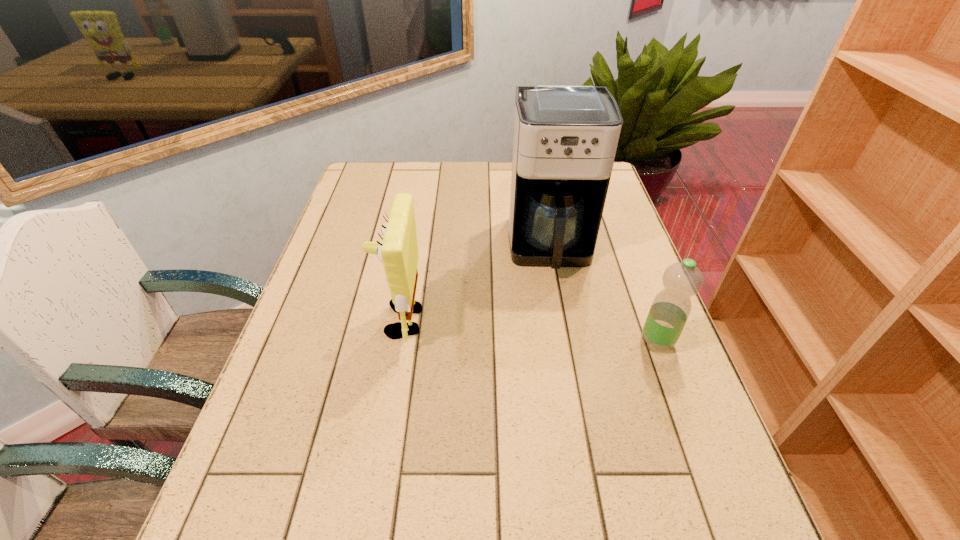
I want to click on free region located 0.060m on the front panel of the tallest object, so click(x=558, y=298).

At what (x,y) coordinates should I click in order to perform the action: click on vacant area situated 0.400m on the front panel of the tallest object. Please return your answer as a coordinate pair (x, y). Image resolution: width=960 pixels, height=540 pixels. Looking at the image, I should click on (576, 420).

You are a GUI agent. You are given a task and a screenshot of the screen. Output one action in this format:
    pyautogui.click(x=<x>, y=<y>)
    Task: Click on the free space located 0.370m on the front panel of the tallest object
    This screenshot has width=960, height=540.
    Given the screenshot: What is the action you would take?
    pyautogui.click(x=573, y=406)

At what (x,y) coordinates should I click in order to perform the action: click on water bottle present at the right edge. Please return your answer as a coordinate pair (x, y). Looking at the image, I should click on (670, 309).

This screenshot has width=960, height=540. In order to click on coffee maker that is at the right edge in this screenshot , I will do `click(565, 139)`.

At what (x,y) coordinates should I click in order to perform the action: click on free region at the far edge of the desktop. Please return your answer as a coordinate pair (x, y). This screenshot has height=540, width=960. Looking at the image, I should click on (445, 163).

The image size is (960, 540). I want to click on free region at the near edge of the desktop, so click(585, 477).

I want to click on free space at the left edge of the desktop, so click(x=339, y=237).

Locate an element on the screen. vacant space at the right edge is located at coordinates (604, 266).

In the image, there is a desktop. Identify the location of vacant space at the near right corner. The height and width of the screenshot is (540, 960). pos(678,478).